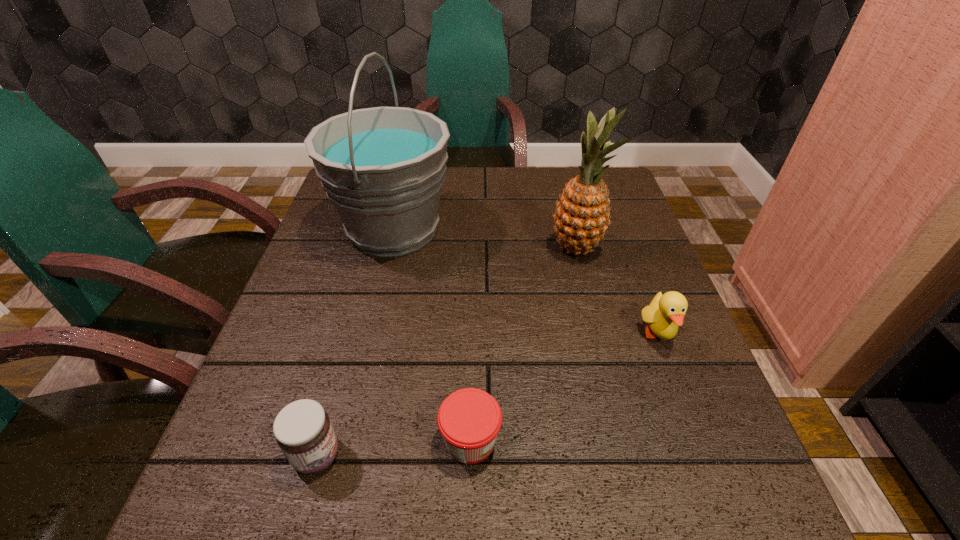
What are the coordinates of `the tallest object` in the screenshot? It's located at (383, 168).

At what (x,y) coordinates should I click in order to perform the action: click on the fourth object from left to right. Please return your answer as a coordinate pair (x, y). This screenshot has width=960, height=540. Looking at the image, I should click on click(x=583, y=214).

At what (x,y) coordinates should I click in order to perform the action: click on pineapple. Please return your answer as a coordinate pair (x, y). The height and width of the screenshot is (540, 960). Looking at the image, I should click on (583, 214).

This screenshot has width=960, height=540. Find the location of `duckling`. duckling is located at coordinates (666, 312).

Locate an element on the screen. This screenshot has height=540, width=960. the third farthest object is located at coordinates (666, 312).

The height and width of the screenshot is (540, 960). I want to click on the left jam, so click(x=303, y=431).

Identify the location of the shortest object. The width and height of the screenshot is (960, 540). (469, 419).

Locate an element on the screen. the right jam is located at coordinates (469, 419).

Find the location of `vacant region located 0.160m on the front of the tallest object`. vacant region located 0.160m on the front of the tallest object is located at coordinates (372, 325).

Find the location of a particular element. Image resolution: width=960 pixels, height=540 pixels. vacant space located on the front of the second object from right to left is located at coordinates (594, 318).